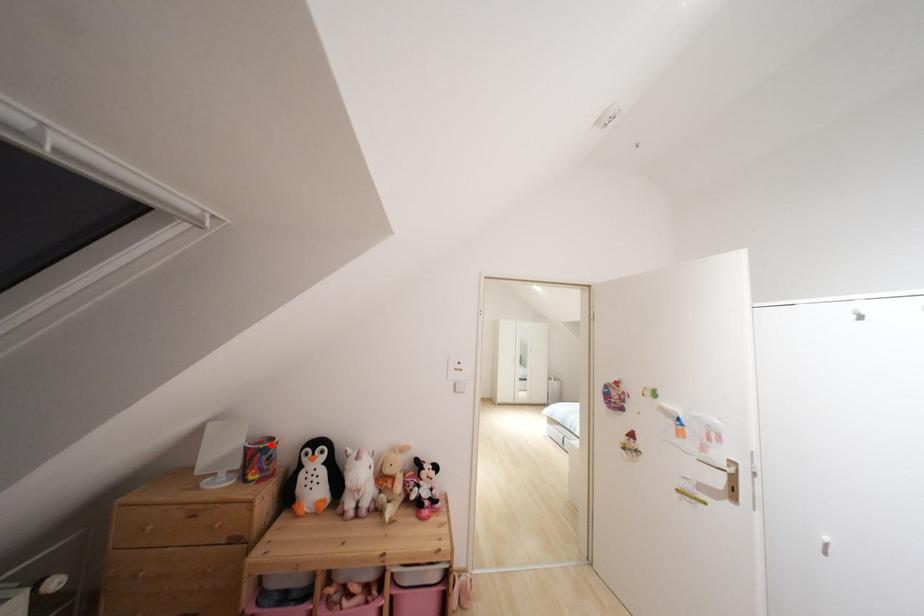
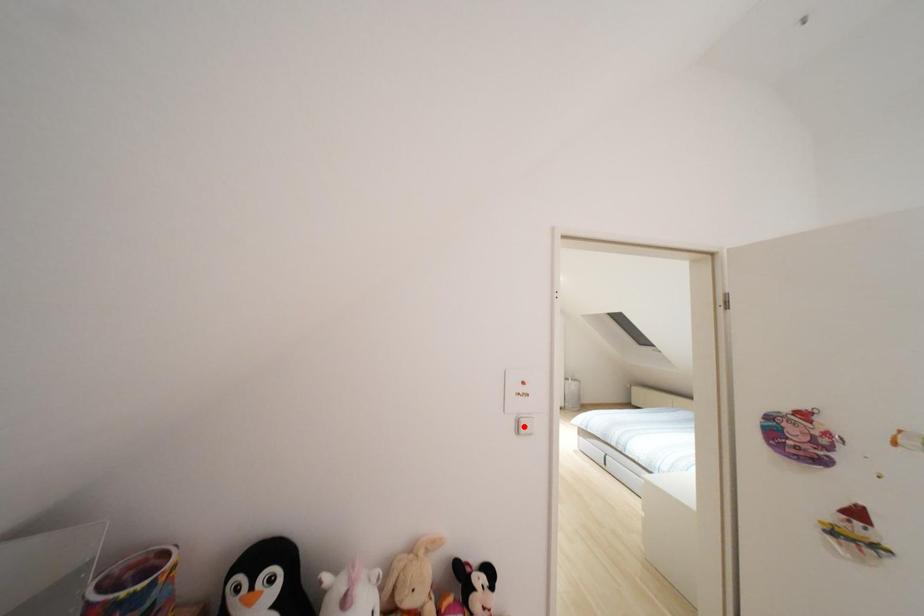
I am providing you with two images of the same scene from different viewpoints. A red point is marked on the first image and another point is marked on the second image. Is the red point in image1 aligned with the point shown in image2?

No